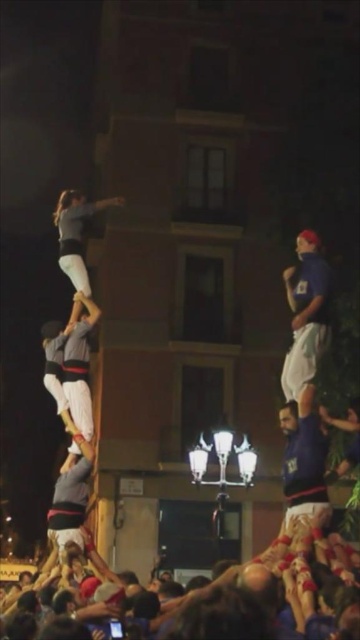
Question: Considering the relative positions of white cotton crowd at lower center and blue fabric shirt at upper right in the image provided, where is white cotton crowd at lower center located with respect to blue fabric shirt at upper right?

Choices:
 (A) below
 (B) above

Answer: (A)

Question: Which object appears closest to the camera in this image?

Choices:
 (A) blue fabric shirt at upper right
 (B) white cotton crowd at lower center

Answer: (B)

Question: Is white cotton crowd at lower center to the right of blue fabric shirt at upper right from the viewer's perspective?

Choices:
 (A) yes
 (B) no

Answer: (B)

Question: Is white cotton crowd at lower center below blue fabric shirt at upper right?

Choices:
 (A) no
 (B) yes

Answer: (B)